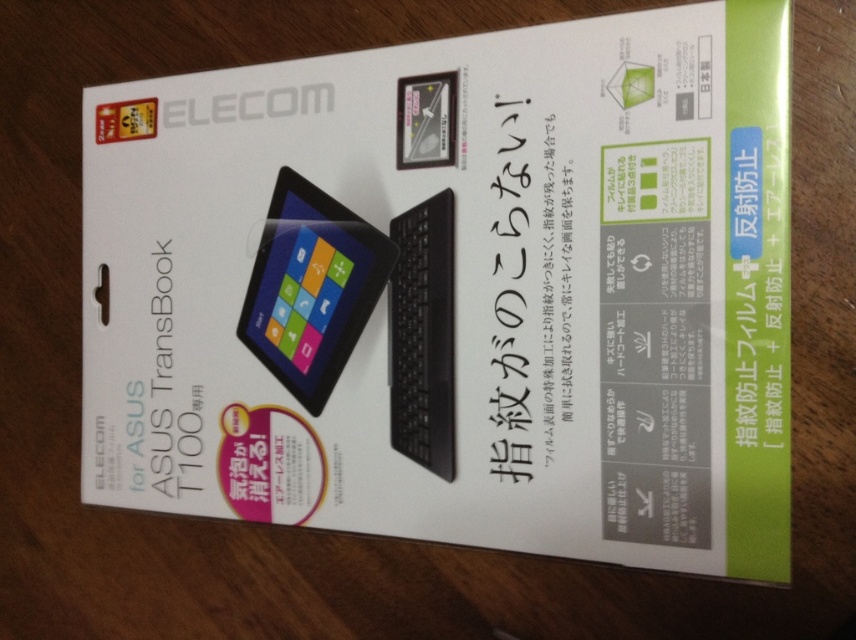
Describe the element at coordinates (311, 288) in the screenshot. The image size is (856, 640). I see `matte black tablet at center` at that location.

Is matte black tablet at center to the left of black matte keyboard at center from the viewer's perspective?

Indeed, matte black tablet at center is positioned on the left side of black matte keyboard at center.

What are the coordinates of `matte black tablet at center` in the screenshot? It's located at (311, 288).

Find the location of a particular element. The height and width of the screenshot is (640, 856). matte black tablet at center is located at coordinates (311, 288).